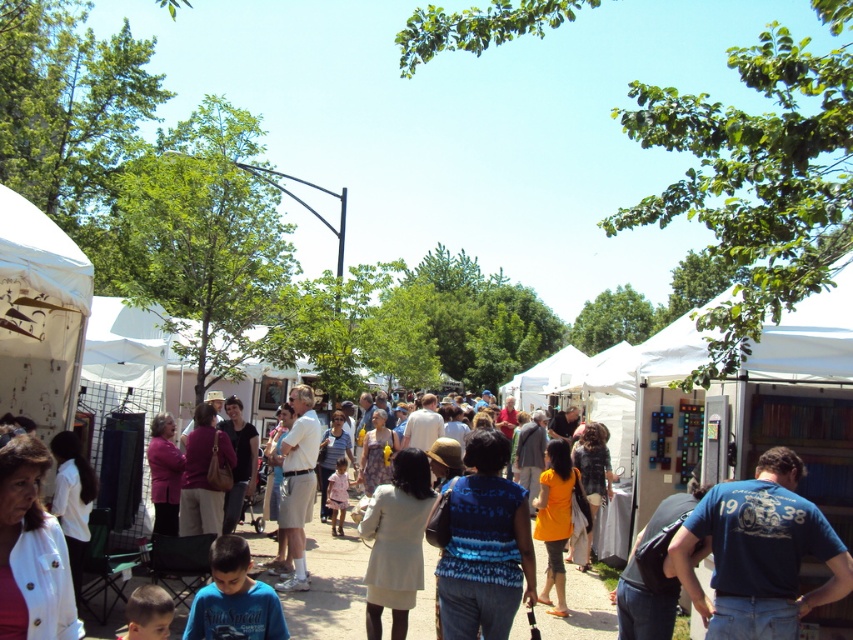
Does point (466, 561) come in front of point (289, 621)?

That is True.

Does blue patterned shirt at center have a greater width compared to light brown fabric crowd at center?

In fact, blue patterned shirt at center might be narrower than light brown fabric crowd at center.

Which is behind, point (474, 604) or point (339, 576)?

The point (339, 576) is more distant.

Locate an element on the screen. blue patterned shirt at center is located at coordinates (485, 545).

Is blue patterned shirt at center bigger than light beige shorts at center?

Incorrect, blue patterned shirt at center is not larger than light beige shorts at center.

Is blue patterned shirt at center taller than light beige shorts at center?

No, blue patterned shirt at center is not taller than light beige shorts at center.

Is point (498, 476) behind point (288, 436)?

No, it is not.

Where is `blue patterned shirt at center`? This screenshot has height=640, width=853. blue patterned shirt at center is located at coordinates (485, 545).

Is blue cotton t-shirt at center-right in front of light beige shorts at center?

Yes, it is.

Is blue cotton t-shirt at center-right behind light beige shorts at center?

No, blue cotton t-shirt at center-right is closer to the viewer.

The height and width of the screenshot is (640, 853). Describe the element at coordinates (759, 552) in the screenshot. I see `blue cotton t-shirt at center-right` at that location.

This screenshot has height=640, width=853. Identify the location of blue cotton t-shirt at center-right. (759, 552).